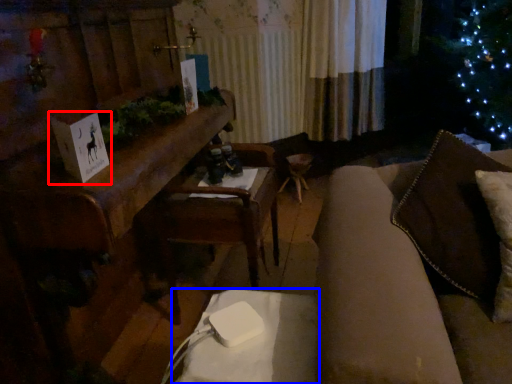
Question: Among these objects, which one is farthest to the camera, christmas card (highlighted by a red box) or table (highlighted by a blue box)?

Choices:
 (A) christmas card
 (B) table

Answer: (A)